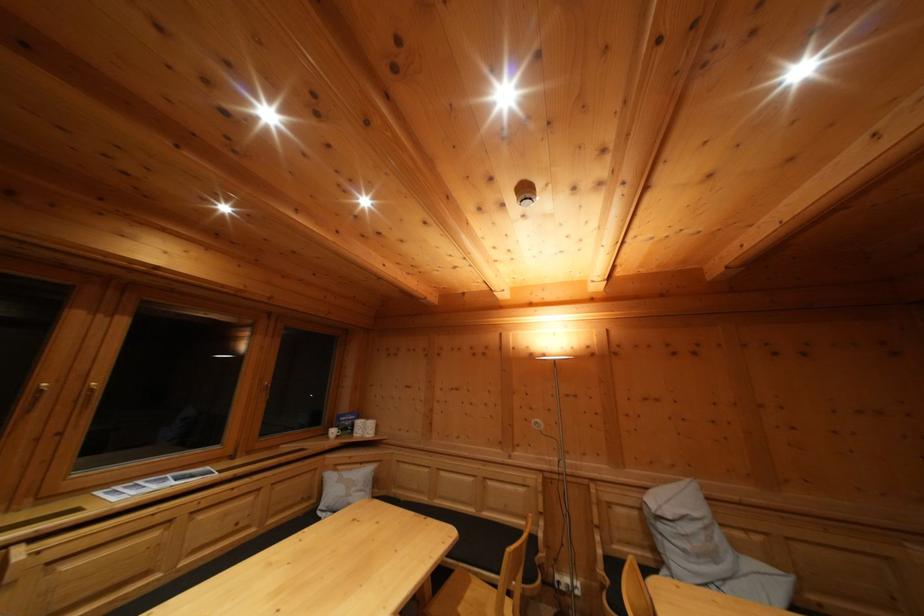
Describe the element at coordinates (488, 541) in the screenshot. Image resolution: width=924 pixels, height=616 pixels. I see `the bench sitting surface` at that location.